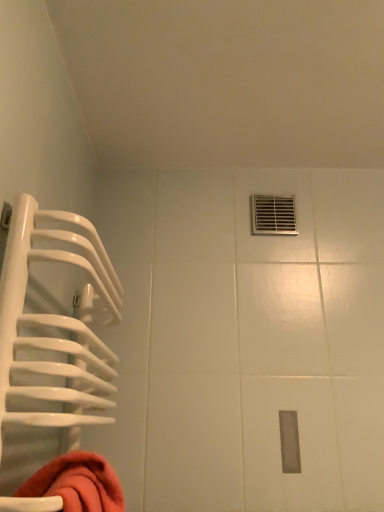
Question: Is metallic vent at upper right not within white glossy towel rack at left?

Choices:
 (A) no
 (B) yes

Answer: (B)

Question: Is metallic vent at upper right at the right side of white glossy towel rack at left?

Choices:
 (A) no
 (B) yes

Answer: (B)

Question: From the image's perspective, would you say metallic vent at upper right is positioned over white glossy towel rack at left?

Choices:
 (A) no
 (B) yes

Answer: (B)

Question: From a real-world perspective, is metallic vent at upper right under white glossy towel rack at left?

Choices:
 (A) no
 (B) yes

Answer: (A)

Question: Considering the relative sizes of metallic vent at upper right and white glossy towel rack at left in the image provided, is metallic vent at upper right smaller than white glossy towel rack at left?

Choices:
 (A) yes
 (B) no

Answer: (A)

Question: Is metallic vent at upper right thinner than white glossy towel rack at left?

Choices:
 (A) yes
 (B) no

Answer: (A)

Question: Is white glossy towel rack at left positioned behind metallic vent at upper right?

Choices:
 (A) yes
 (B) no

Answer: (B)

Question: Is white glossy towel rack at left positioned before metallic vent at upper right?

Choices:
 (A) no
 (B) yes

Answer: (B)

Question: Can metallic vent at upper right be found inside white glossy towel rack at left?

Choices:
 (A) no
 (B) yes

Answer: (A)

Question: From a real-world perspective, is white glossy towel rack at left physically above metallic vent at upper right?

Choices:
 (A) yes
 (B) no

Answer: (B)

Question: Is white glossy towel rack at left to the left of metallic vent at upper right from the viewer's perspective?

Choices:
 (A) yes
 (B) no

Answer: (A)

Question: Is white glossy towel rack at left at the right side of metallic vent at upper right?

Choices:
 (A) no
 (B) yes

Answer: (A)

Question: Considering their positions, is white glossy towel rack at left located in front of or behind metallic vent at upper right?

Choices:
 (A) behind
 (B) front

Answer: (B)